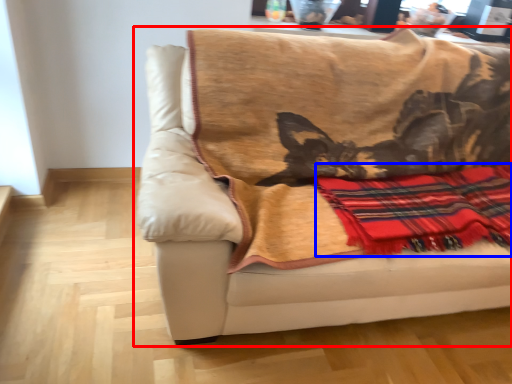
Question: Which point is further to the camera, studio couch (highlighted by a red box) or plaid (highlighted by a blue box)?

Choices:
 (A) studio couch
 (B) plaid

Answer: (B)